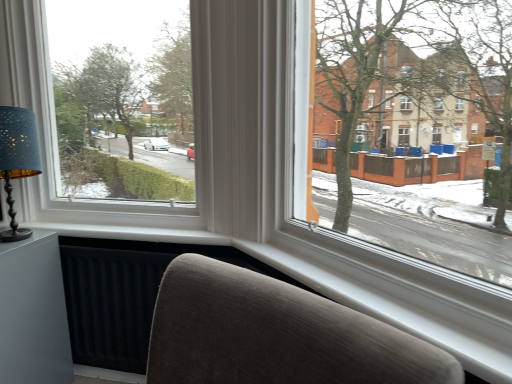
Question: Would you say matte blue lampshade at left is inside or outside white plastic window at upper left?

Choices:
 (A) outside
 (B) inside

Answer: (A)

Question: From the image's perspective, is matte blue lampshade at left located above or below white plastic window at upper left?

Choices:
 (A) below
 (B) above

Answer: (A)

Question: Estimate the real-world distances between objects in this image. Which object is closer to the matte gray table at lower left?

Choices:
 (A) matte blue lampshade at left
 (B) white plastic window at upper left

Answer: (A)

Question: Considering the real-world distances, which object is closest to the matte blue lampshade at left?

Choices:
 (A) matte gray table at lower left
 (B) white plastic window at upper left

Answer: (B)